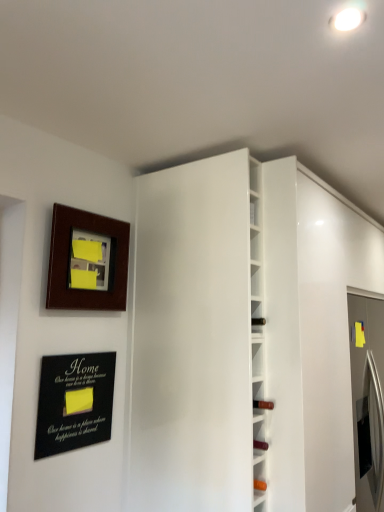
Question: From the image's perspective, is white glossy door at center under black matte plaque at lower left?

Choices:
 (A) no
 (B) yes

Answer: (A)

Question: Is white glossy door at center thinner than black matte plaque at lower left?

Choices:
 (A) yes
 (B) no

Answer: (B)

Question: Is white glossy door at center shorter than black matte plaque at lower left?

Choices:
 (A) yes
 (B) no

Answer: (B)

Question: Can you confirm if white glossy door at center is bigger than black matte plaque at lower left?

Choices:
 (A) yes
 (B) no

Answer: (A)

Question: Could you tell me if white glossy door at center is facing black matte plaque at lower left?

Choices:
 (A) no
 (B) yes

Answer: (A)

Question: Are white glossy door at center and black matte plaque at lower left far apart?

Choices:
 (A) yes
 (B) no

Answer: (B)

Question: From the image's perspective, is white glossy wine rack at center located above black matte plaque at lower left?

Choices:
 (A) yes
 (B) no

Answer: (B)

Question: Is white glossy wine rack at center aimed at black matte plaque at lower left?

Choices:
 (A) yes
 (B) no

Answer: (B)

Question: Considering the relative sizes of white glossy wine rack at center and black matte plaque at lower left in the image provided, is white glossy wine rack at center smaller than black matte plaque at lower left?

Choices:
 (A) no
 (B) yes

Answer: (A)

Question: Does white glossy wine rack at center have a greater width compared to black matte plaque at lower left?

Choices:
 (A) no
 (B) yes

Answer: (B)

Question: Is white glossy wine rack at center oriented away from black matte plaque at lower left?

Choices:
 (A) no
 (B) yes

Answer: (A)

Question: Is white glossy wine rack at center further to the viewer compared to black matte plaque at lower left?

Choices:
 (A) yes
 (B) no

Answer: (B)

Question: Can you confirm if black matte plaque at lower left is smaller than white glossy door at center?

Choices:
 (A) yes
 (B) no

Answer: (A)